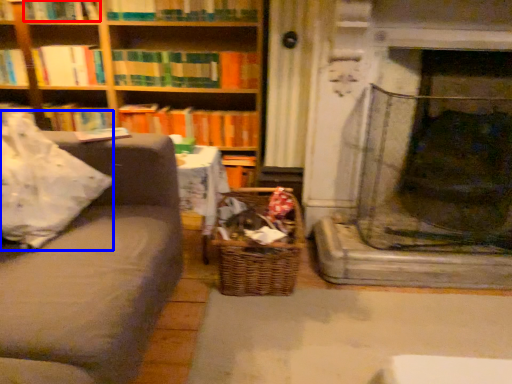
Question: Which of the following is the closest to the observer, book (highlighted by a red box) or pillow (highlighted by a blue box)?

Choices:
 (A) book
 (B) pillow

Answer: (B)